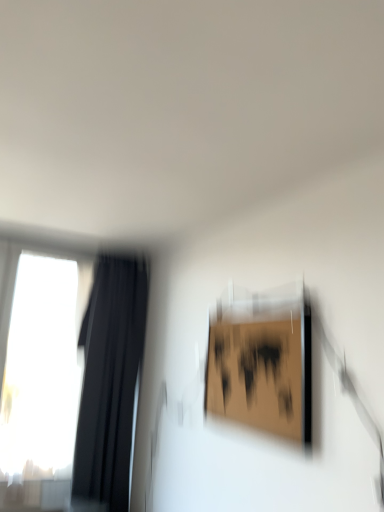
Question: Is transparent glass window at left outside black fabric curtain at left?

Choices:
 (A) yes
 (B) no

Answer: (A)

Question: Does transparent glass window at left touch black fabric curtain at left?

Choices:
 (A) yes
 (B) no

Answer: (A)

Question: From a real-world perspective, does transparent glass window at left sit lower than black fabric curtain at left?

Choices:
 (A) yes
 (B) no

Answer: (B)

Question: Does transparent glass window at left have a lesser width compared to black fabric curtain at left?

Choices:
 (A) yes
 (B) no

Answer: (A)

Question: Is transparent glass window at left at the right side of black fabric curtain at left?

Choices:
 (A) yes
 (B) no

Answer: (B)

Question: Visually, is black fabric curtain at left positioned to the left or to the right of wooden frame at upper right?

Choices:
 (A) right
 (B) left

Answer: (B)

Question: Is black fabric curtain at left inside or outside of wooden frame at upper right?

Choices:
 (A) inside
 (B) outside

Answer: (B)

Question: Considering the positions of black fabric curtain at left and wooden frame at upper right in the image, is black fabric curtain at left bigger or smaller than wooden frame at upper right?

Choices:
 (A) small
 (B) big

Answer: (B)

Question: In the image, is black fabric curtain at left positioned in front of or behind wooden frame at upper right?

Choices:
 (A) behind
 (B) front

Answer: (A)

Question: Visually, is wooden frame at upper right positioned to the left or to the right of black fabric curtain at left?

Choices:
 (A) right
 (B) left

Answer: (A)

Question: In terms of height, does wooden frame at upper right look taller or shorter compared to black fabric curtain at left?

Choices:
 (A) tall
 (B) short

Answer: (B)

Question: From a real-world perspective, is wooden frame at upper right positioned above or below black fabric curtain at left?

Choices:
 (A) above
 (B) below

Answer: (A)

Question: Is wooden frame at upper right inside or outside of black fabric curtain at left?

Choices:
 (A) inside
 (B) outside

Answer: (B)

Question: Is transparent glass window at left bigger or smaller than black fabric curtain at left?

Choices:
 (A) small
 (B) big

Answer: (A)

Question: From the image's perspective, is transparent glass window at left above or below black fabric curtain at left?

Choices:
 (A) above
 (B) below

Answer: (A)